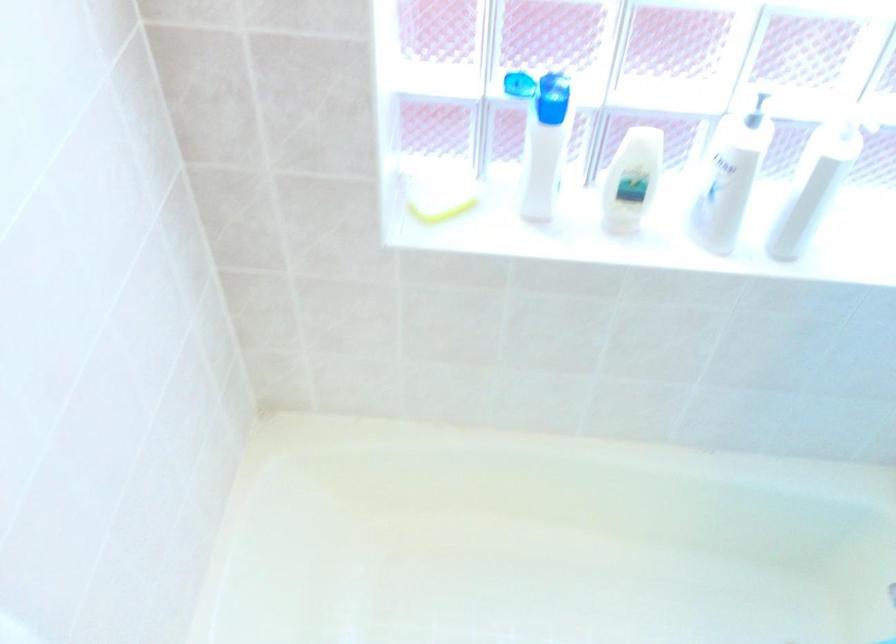
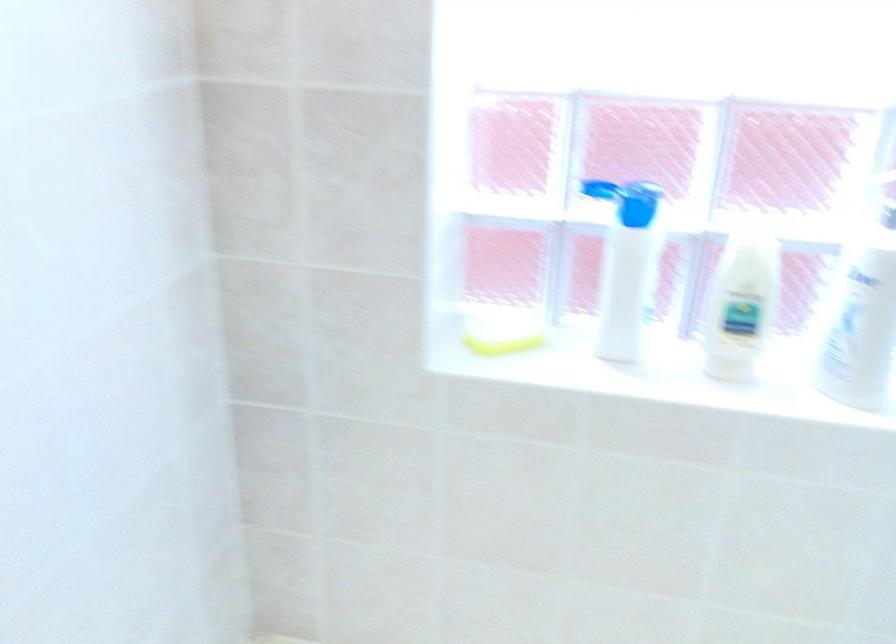
In the second image, find the point that corresponds to (x=633, y=180) in the first image.

(741, 305)